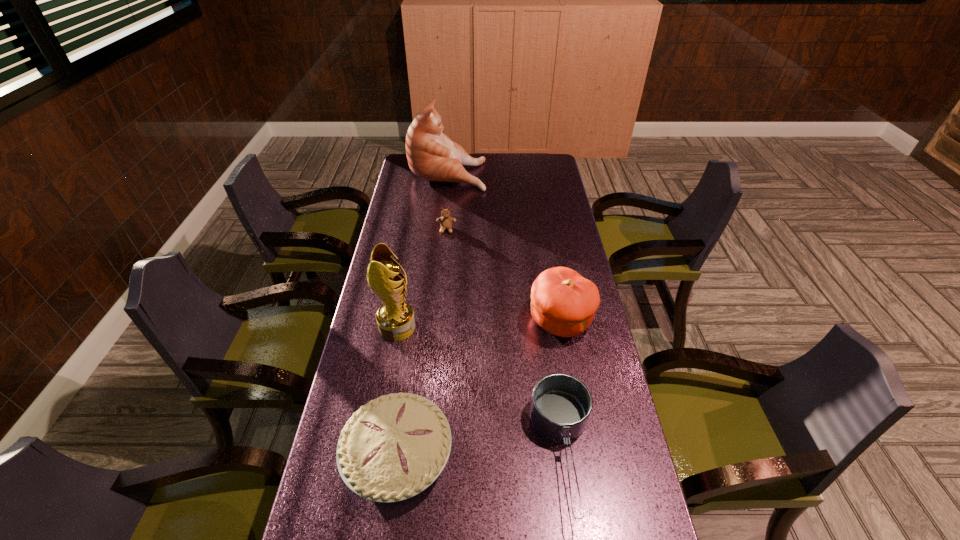
Where is `free location at the far right corner`? The height and width of the screenshot is (540, 960). free location at the far right corner is located at coordinates (527, 168).

Image resolution: width=960 pixels, height=540 pixels. In order to click on vacant area between the saucepan and the pie in this screenshot , I will do `click(481, 454)`.

The height and width of the screenshot is (540, 960). What are the coordinates of `vacant space in between the cat and the teddy bear` in the screenshot? It's located at (447, 201).

Locate an element on the screen. free space between the farthest object and the pie is located at coordinates (422, 313).

Where is `free spot between the saucepan and the pie`? This screenshot has width=960, height=540. free spot between the saucepan and the pie is located at coordinates (481, 454).

Where is `free area in between the pie and the teddy bear`? This screenshot has width=960, height=540. free area in between the pie and the teddy bear is located at coordinates (422, 342).

This screenshot has height=540, width=960. In order to click on empty space between the award and the teddy bear in this screenshot , I will do `click(421, 279)`.

Identify the location of free spot between the pie and the teddy bear. This screenshot has width=960, height=540. (422, 342).

The image size is (960, 540). Find the location of `vacant region between the cat and the saucepan`. vacant region between the cat and the saucepan is located at coordinates (506, 313).

Identify the location of free space that is in between the farthest object and the pie. This screenshot has height=540, width=960. (422, 313).